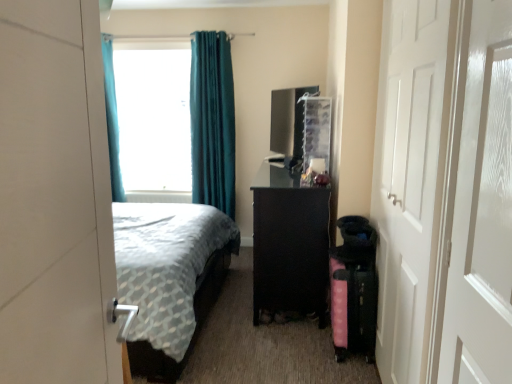
Question: Considering the relative positions of teal velvet curtain at upper center, the 1th curtain viewed from the right, and white matte door at right, which ranks as the 1th door in right-to-left order, in the image provided, is teal velvet curtain at upper center, the 1th curtain viewed from the right, to the left or to the right of white matte door at right, which ranks as the 1th door in right-to-left order,?

Choices:
 (A) left
 (B) right

Answer: (A)

Question: Looking at the image, does teal velvet curtain at upper center, which is the 2th curtain from left to right, seem bigger or smaller compared to white matte door at right, which ranks as the 1th door in right-to-left order?

Choices:
 (A) big
 (B) small

Answer: (A)

Question: Which of these objects is positioned closest to the teal fabric curtain at left, placed as the first curtain when sorted from left to right?

Choices:
 (A) white matte door at right, which ranks as the 1th door in back-to-front order
 (B) transparent frosted glass screen door at right
 (C) blue fabric curtain at upper center
 (D) white glossy door at left, which appears as the first door when viewed from the front
 (E) pink fabric suitcase at lower right

Answer: (C)

Question: Estimate the real-world distances between objects in this image. Which object is farther from the teal fabric curtain at left, the second curtain when ordered from right to left?

Choices:
 (A) transparent frosted glass screen door at right
 (B) white glossy door at left, the second door in the right-to-left sequence
 (C) blue fabric curtain at upper center
 (D) teal velvet curtain at upper center, the 1th curtain viewed from the right
 (E) pink fabric suitcase at lower right

Answer: (A)